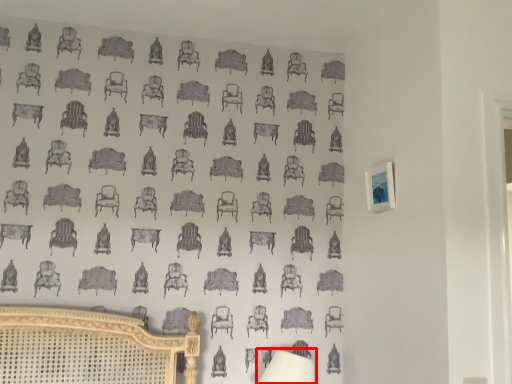
Question: From the image, what is the correct spatial relationship of table lamp (annotated by the red box) in relation to picture frame?

Choices:
 (A) left
 (B) right

Answer: (A)